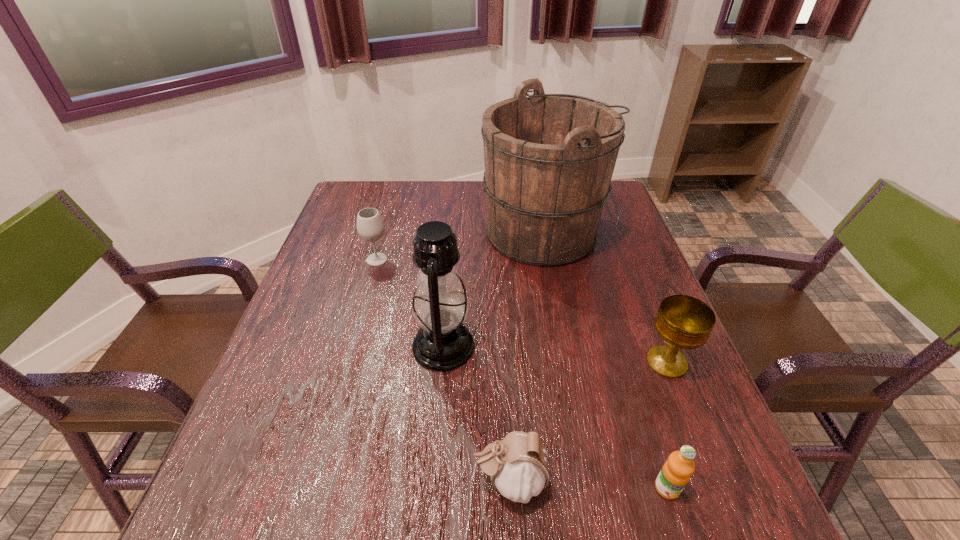
The width and height of the screenshot is (960, 540). I want to click on vacant space located on the right of the wineglass, so click(x=434, y=259).

Find the location of a particular element. This screenshot has width=960, height=540. vacant space located on the front-facing side of the pouch is located at coordinates (339, 481).

Locate an element on the screen. The height and width of the screenshot is (540, 960). vacant space situated on the front-facing side of the pouch is located at coordinates (303, 481).

Locate an element on the screen. Image resolution: width=960 pixels, height=540 pixels. free location located on the front-facing side of the pouch is located at coordinates (397, 481).

Locate an element on the screen. The height and width of the screenshot is (540, 960). vacant region located 0.050m on the label of the orange juice is located at coordinates coord(682,534).

Image resolution: width=960 pixels, height=540 pixels. Find the location of `object located in the far edge section of the desktop`. object located in the far edge section of the desktop is located at coordinates (549, 158).

This screenshot has width=960, height=540. What are the coordinates of `pouch that is at the near edge` in the screenshot? It's located at (518, 465).

This screenshot has height=540, width=960. I want to click on orange juice present at the near edge, so click(677, 470).

Locate an element on the screen. This screenshot has width=960, height=540. object located at the left edge is located at coordinates (370, 226).

I want to click on bucket present at the right edge, so click(549, 158).